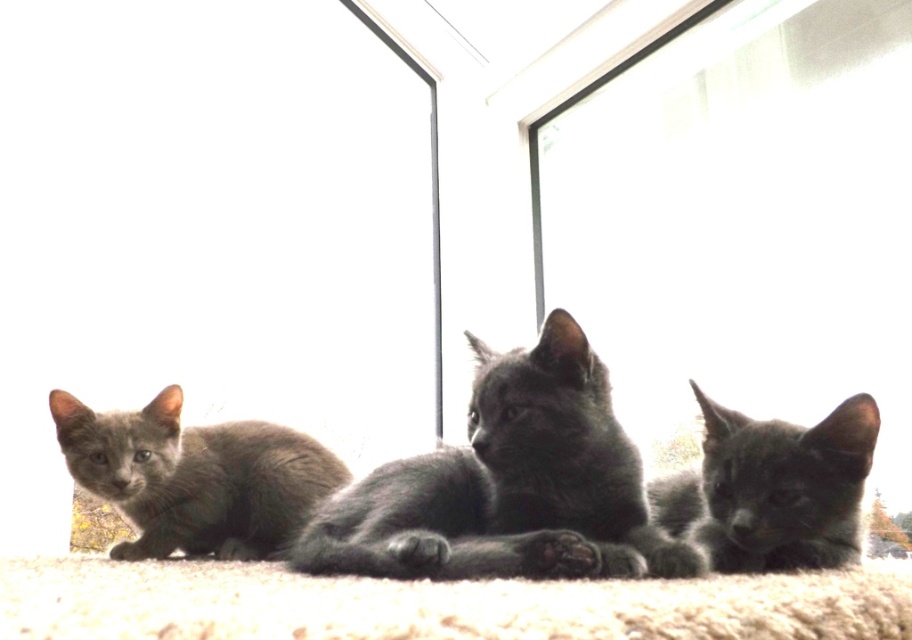
Question: Does transparent glass screen door at left appear on the left side of transparent glass window at upper center?

Choices:
 (A) no
 (B) yes

Answer: (B)

Question: Is transparent glass window at upper center behind shiny black kitten at center?

Choices:
 (A) no
 (B) yes

Answer: (B)

Question: Among these points, which one is nearest to the camera?

Choices:
 (A) (344, 336)
 (B) (162, 508)

Answer: (B)

Question: Among these objects, which one is nearest to the camera?

Choices:
 (A) transparent glass screen door at left
 (B) shiny black kitten at center
 (C) gray fur kitten at lower left

Answer: (B)

Question: Is gray fur kitten at lower left bigger than shiny black kitten at center?

Choices:
 (A) no
 (B) yes

Answer: (B)

Question: Which of the following is the closest to the observer?

Choices:
 (A) (772, 560)
 (B) (277, 536)

Answer: (A)